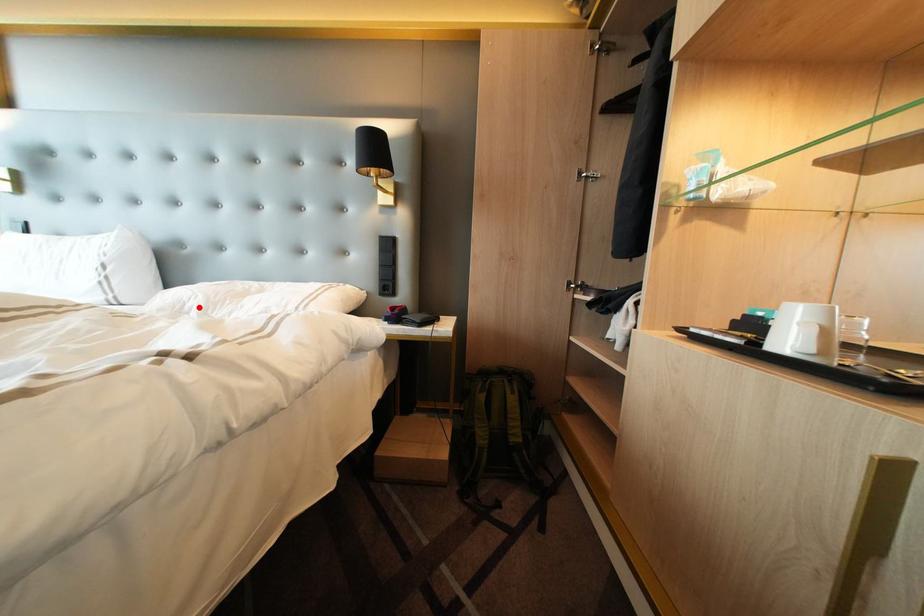
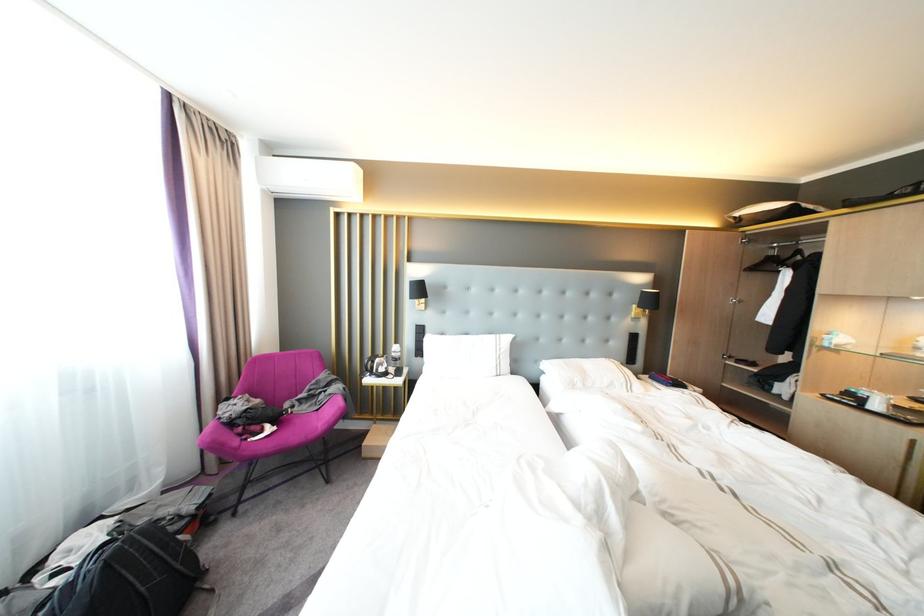
Where in the second image is the point corresponding to the highlighted location from the first image?

(586, 382)